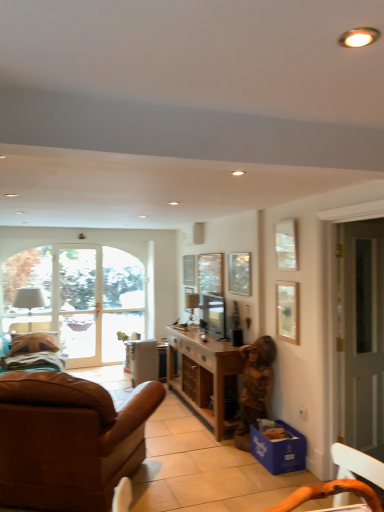
Question: From the image's perspective, relative to satin black television at center, the first television from the back, is blue cardboard box at lower right above or below?

Choices:
 (A) below
 (B) above

Answer: (A)

Question: Is blue cardboard box at lower right taller or shorter than satin black television at center, the 2th television from the front?

Choices:
 (A) tall
 (B) short

Answer: (B)

Question: Which object is the farthest from the orange wood chair at lower right?

Choices:
 (A) clear glass window at center
 (B) matte wood desk at center
 (C) matte white picture frame at upper right, acting as the first picture frame starting from the right
 (D) satin black tv at center, which appears as the first television when viewed from the front
 (E) satin black television at center, the 2th television from the front

Answer: (A)

Question: Considering the real-world distances, which object is closest to the matte white picture frame at upper center, which appears as the second picture frame when viewed from the back?

Choices:
 (A) wooden statue at lower right
 (B) clear glass window screen at center
 (C) wooden picture frame at upper center, the 3th picture frame when ordered from right to left
 (D) white glass screen door at right
 (E) matte black speaker at center

Answer: (C)